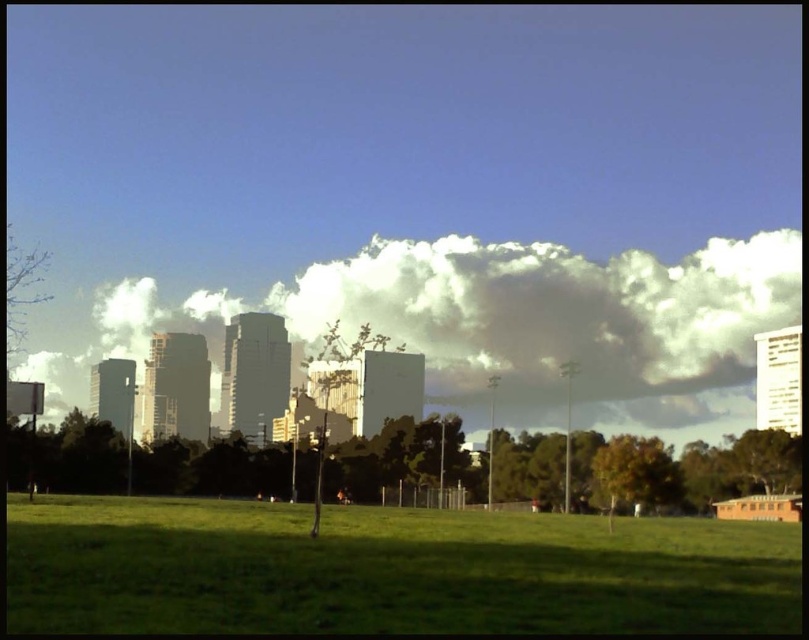
You are standing at the point marked as point (388, 570) in the image. What is the immediate surface beneath your feet?

The immediate surface beneath your feet at point (388, 570) is the green grassy field at lower center.

You are a drone operator planning to fly a drone from the green grassy field at lower center to the white fluffy cloud at upper center. Given that the drone has a maximum flight range of 400 meters, can it reach the cloud?

The green grassy field at lower center is 427.48 meters away from the white fluffy cloud at upper center. Since the drone can only fly up to 400 meters, it cannot reach the cloud.

You are standing at the origin point of the coordinate system. You want to walk to the green grassy field at lower center. What direction should you go to reach it?

The green grassy field at lower center is located at coordinate point (388, 570). Since the coordinate system typically has the origin at the bottom left corner, moving towards the right and slightly upwards would lead you to the green grassy field at lower center.